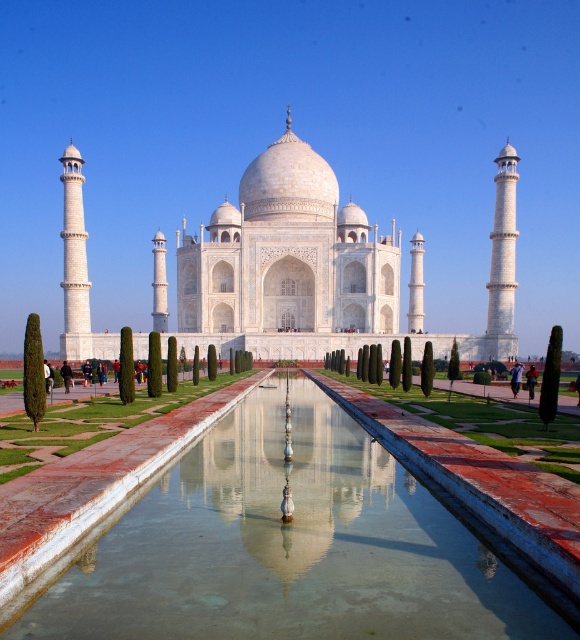
Question: Which point is closer to the camera?

Choices:
 (A) clear glass water at center
 (B) white marble water at center
 (C) white marble taj mahal at center

Answer: (A)

Question: Among these objects, which one is nearest to the camera?

Choices:
 (A) white marble taj mahal at center
 (B) clear glass water at center

Answer: (B)

Question: From the image, what is the correct spatial relationship of clear glass water at center in relation to white marble taj mahal at center?

Choices:
 (A) above
 (B) below

Answer: (B)

Question: Does clear glass water at center appear under white marble taj mahal at center?

Choices:
 (A) no
 (B) yes

Answer: (B)

Question: Can you confirm if white marble taj mahal at center is bigger than white marble water at center?

Choices:
 (A) no
 (B) yes

Answer: (B)

Question: Which object appears closest to the camera in this image?

Choices:
 (A) white marble water at center
 (B) clear glass water at center

Answer: (B)